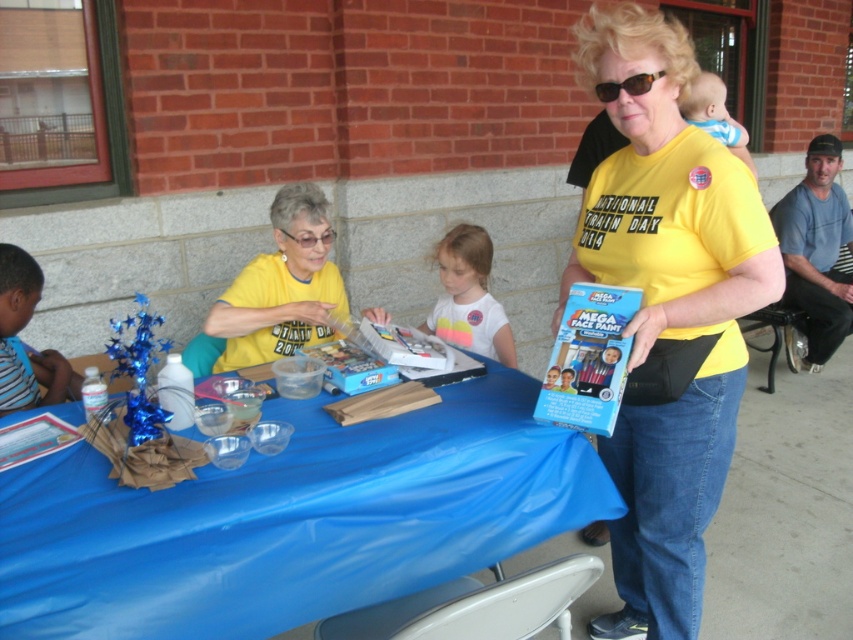
Question: Which object is the farthest from the yellow matte shirt at center?

Choices:
 (A) blue denim jeans at lower right
 (B) white cotton shirt at center
 (C) blue plastic table at center
 (D) tortoiseshell plastic goggles at upper center

Answer: (A)

Question: Is yellow matte shirt at center positioned in front of blue denim jeans at lower right?

Choices:
 (A) no
 (B) yes

Answer: (B)

Question: Does yellow matte shirt at center appear on the left side of white cotton shirt at center?

Choices:
 (A) yes
 (B) no

Answer: (A)

Question: Which object appears farthest from the camera in this image?

Choices:
 (A) blue striped shirt at left
 (B) tortoiseshell plastic goggles at upper center

Answer: (A)

Question: Among these objects, which one is farthest from the camera?

Choices:
 (A) yellow matte shirt at center
 (B) yellow fabric shirt at center

Answer: (A)

Question: Where is yellow matte shirt at center located in relation to blue striped shirt at left in the image?

Choices:
 (A) below
 (B) above

Answer: (B)